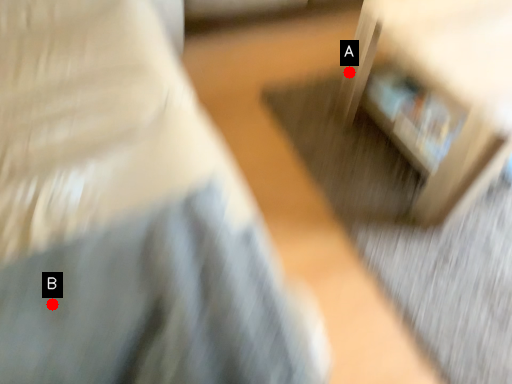
Question: Two points are circled on the image, labeled by A and B beside each circle. Which of the following is the closest to the observer?

Choices:
 (A) A is closer
 (B) B is closer

Answer: (B)